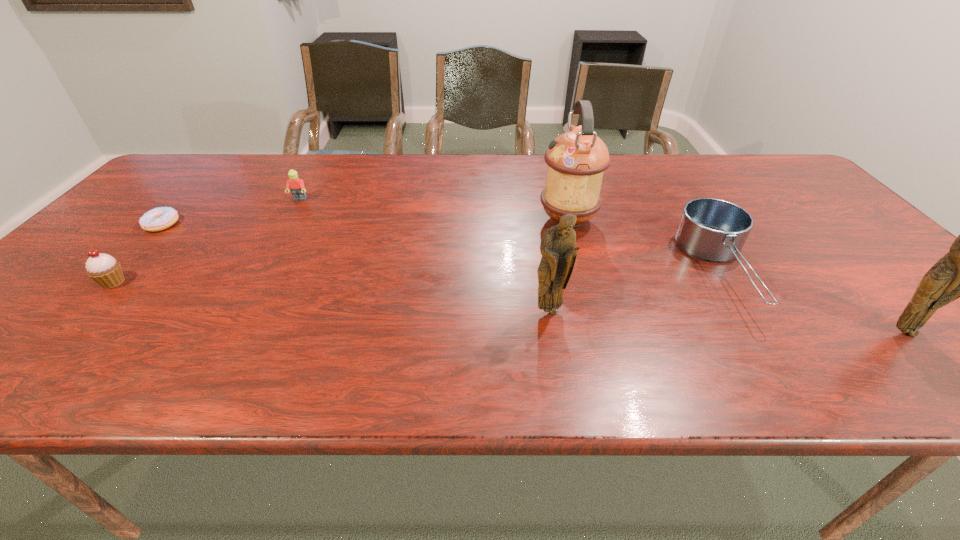
Please point a spot on the left to add another figurine. Please provide its 2D coordinates. Your answer should be formatted as a tuple, i.e. [(x, y)], where the tuple contains the x and y coordinates of a point satisfying the conditions above.

[(228, 292)]